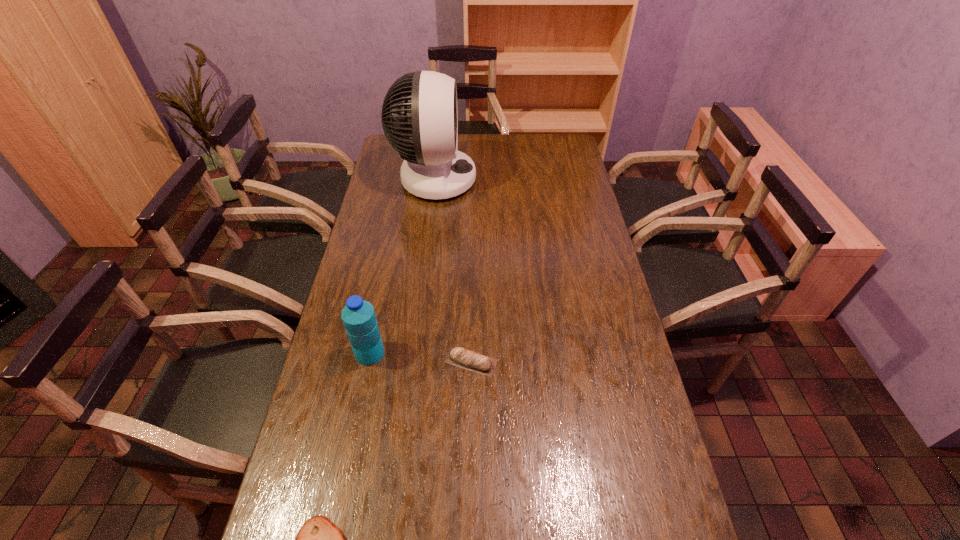
The height and width of the screenshot is (540, 960). In order to click on object that is the second closest to the fan in this screenshot , I will do [459, 357].

Identify which object is the third nearest to the second tallest object. Please provide its 2D coordinates. Your answer should be formatted as a tuple, i.e. [(x, y)], where the tuple contains the x and y coordinates of a point satisfying the conditions above.

[(433, 168)]

Locate an element on the screen. vacant space that satisfies the following two spatial constraints: 1. on the grille of the fan; 2. on the left side of the right pita bread is located at coordinates (412, 362).

Identify the location of vacant space that satisfies the following two spatial constraints: 1. on the grille of the tallest object; 2. on the left side of the right pita bread. The width and height of the screenshot is (960, 540). (412, 362).

Locate an element on the screen. free space that satisfies the following two spatial constraints: 1. on the front side of the farther pita bread; 2. on the right side of the third shortest object is located at coordinates (369, 362).